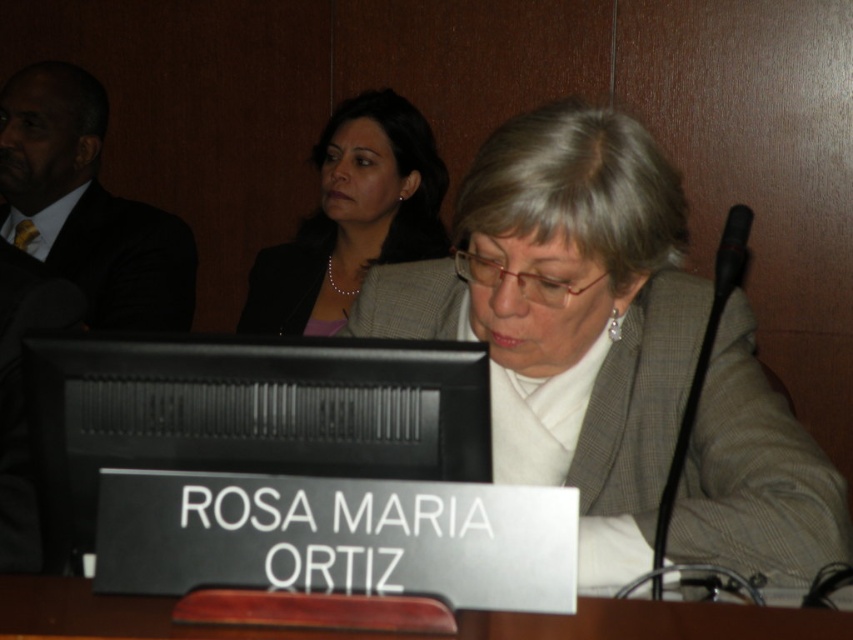
Is brown wood table at center thinner than black textured blazer at upper center?

Incorrect, brown wood table at center's width is not less than black textured blazer at upper center's.

The image size is (853, 640). In order to click on brown wood table at center in this screenshot , I will do `click(405, 634)`.

Is point (569, 630) in front of point (328, 244)?

Yes, point (569, 630) is closer to viewer.

Identify the location of brown wood table at center. The height and width of the screenshot is (640, 853). (405, 634).

Does matte gray blazer at center appear on the right side of brown wood table at center?

Correct, you'll find matte gray blazer at center to the right of brown wood table at center.

Is point (602, 572) farther from viewer compared to point (759, 634)?

Yes.

At what (x,y) coordinates should I click in order to perform the action: click on matte gray blazer at center. Please return your answer as a coordinate pair (x, y). This screenshot has width=853, height=640. Looking at the image, I should click on (567, 316).

How distant is matte black blazer at upper center from brown wood table at center?

A distance of 1.91 meters exists between matte black blazer at upper center and brown wood table at center.

Is matte black blazer at upper center to the left of brown wood table at center from the viewer's perspective?

Indeed, matte black blazer at upper center is positioned on the left side of brown wood table at center.

Describe the element at coordinates (352, 218) in the screenshot. I see `matte black blazer at upper center` at that location.

In order to click on matte black blazer at upper center in this screenshot , I will do `click(352, 218)`.